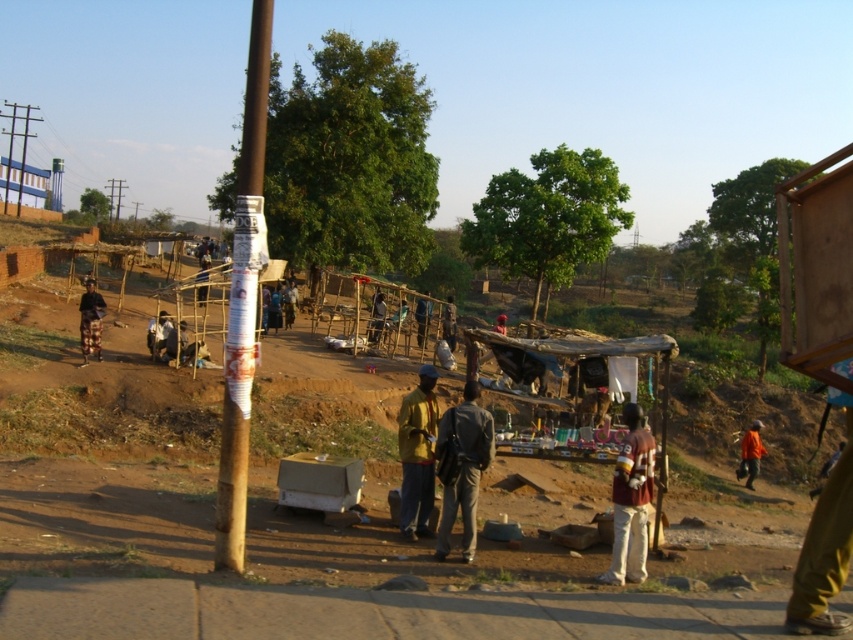
You are standing at the point with coordinates point (416, 454). What object is located at that position?

The yellow matte jacket at center is located at point (416, 454).

Based on the photo, you are standing on the paved area and want to reach the orange fabric at lower right without stepping on the dark brown fabric pants at left. How should you adjust your path?

The dark brown fabric pants at left is above the orange fabric at lower right, so you can walk directly to the orange fabric at lower right without stepping on the dark brown fabric pants at left by moving around or under it.